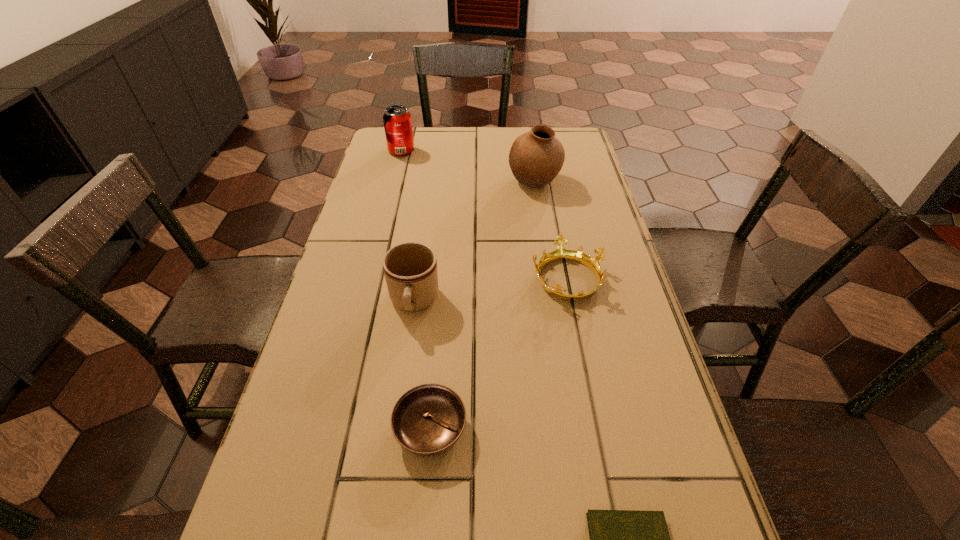
This screenshot has width=960, height=540. Identify the location of vacant space positioned on the side of the fourth shortest object with the handle. (396, 428).

This screenshot has width=960, height=540. Find the location of `vacant space located on the back of the crown`. vacant space located on the back of the crown is located at coordinates (551, 198).

This screenshot has width=960, height=540. Identify the location of free space located on the back of the second shortest object. (444, 268).

At what (x,y) coordinates should I click in order to perform the action: click on object situated at the far edge. Please return your answer as a coordinate pair (x, y). This screenshot has width=960, height=540. Looking at the image, I should click on (397, 120).

Identify the location of soda can that is at the left edge. tap(397, 120).

Where is `mug that is at the left edge`? mug that is at the left edge is located at coordinates (410, 269).

Locate an element on the screen. This screenshot has height=540, width=960. pottery that is at the right edge is located at coordinates (536, 157).

Locate an element on the screen. This screenshot has height=540, width=960. crown at the right edge is located at coordinates (560, 253).

I want to click on object at the far left corner, so click(397, 120).

The width and height of the screenshot is (960, 540). I want to click on vacant space at the far edge of the desktop, so click(427, 131).